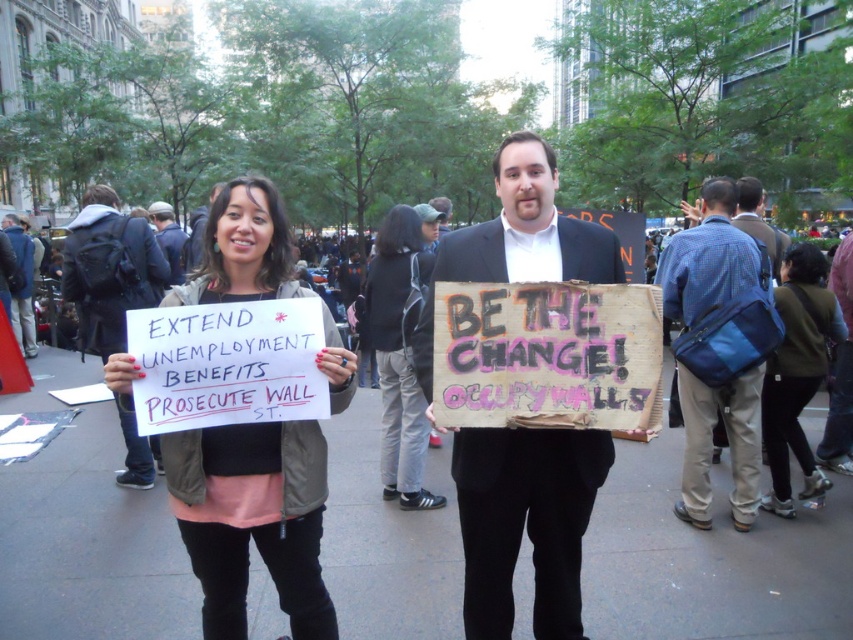
Is point (202, 616) positioned before point (115, 332)?

Yes, point (202, 616) is in front of point (115, 332).

Is matte green jacket at center taller than white cardboard sign at center?

Correct, matte green jacket at center is much taller as white cardboard sign at center.

Between point (193, 554) and point (84, 209), which one is positioned in front?

Point (193, 554)

Locate an element on the screen. The width and height of the screenshot is (853, 640). matte green jacket at center is located at coordinates (252, 518).

Who is positioned more to the left, blue fabric bag at right or black fabric jacket at center?

black fabric jacket at center

Which of these two, blue fabric bag at right or black fabric jacket at center, stands taller?

With more height is black fabric jacket at center.

Locate an element on the screen. This screenshot has width=853, height=640. blue fabric bag at right is located at coordinates (706, 257).

Describe the element at coordinates (525, 522) in the screenshot. I see `wooden sign at center` at that location.

Which is behind, point (560, 600) or point (181, 465)?

The point (560, 600) is more distant.

I want to click on wooden sign at center, so click(525, 522).

What are the coordinates of `wooden sign at center` in the screenshot? It's located at (525, 522).